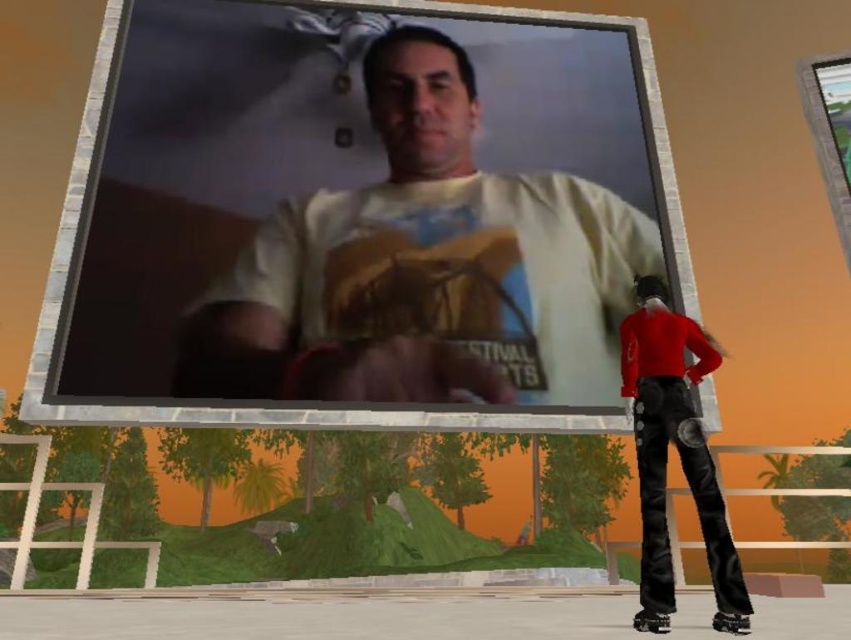
Who is lower down, matte plastic billboard at center or leather pants at lower right?

leather pants at lower right is below.

Is point (410, 378) positioned in front of point (648, 337)?

No, (410, 378) is further to viewer.

Which is in front, point (614, 166) or point (666, 321)?

Positioned in front is point (666, 321).

The height and width of the screenshot is (640, 851). Find the location of `matte plastic billboard at center`. matte plastic billboard at center is located at coordinates (358, 218).